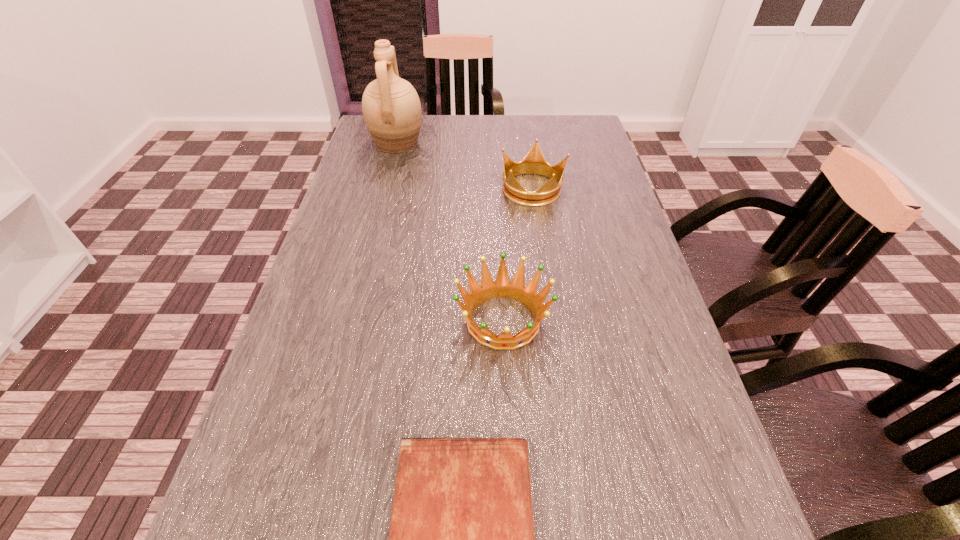
Locate an element on the screen. The height and width of the screenshot is (540, 960). object at the far left corner is located at coordinates (391, 108).

In the image, there is a desktop. Find the location of `vacant space at the far edge`. vacant space at the far edge is located at coordinates (535, 126).

Find the location of `free space at the left edge`. free space at the left edge is located at coordinates (243, 496).

Locate an element on the screen. Image resolution: width=960 pixels, height=540 pixels. vacant point at the right edge is located at coordinates (644, 455).

The height and width of the screenshot is (540, 960). Find the location of `empty location between the leftmost object and the third nearest object`. empty location between the leftmost object and the third nearest object is located at coordinates (465, 166).

Identify the location of vacant space that's between the farthest object and the nearer crown. Image resolution: width=960 pixels, height=540 pixels. (450, 232).

Where is `free area in between the third farthest object and the second farthest object`? free area in between the third farthest object and the second farthest object is located at coordinates (518, 254).

The image size is (960, 540). In order to click on free space that is in between the third farthest object and the farthest object in this screenshot , I will do `click(450, 232)`.

Identify which object is the second nearest to the farther crown. Please provide its 2D coordinates. Your answer should be formatted as a tuple, i.e. [(x, y)], where the tuple contains the x and y coordinates of a point satisfying the conditions above.

[(502, 287)]

At what (x,y) coordinates should I click in order to perform the action: click on object that is the second closest one to the shortest object. Please return your answer as a coordinate pair (x, y). The image size is (960, 540). Looking at the image, I should click on (534, 162).